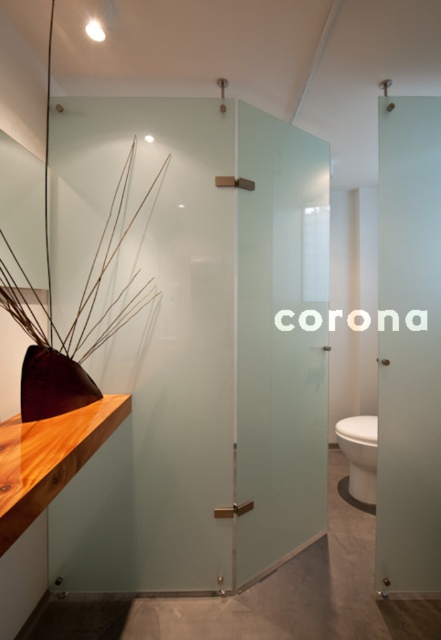
Based on the photo, between frosted glass screen door at center and satin glass screen door at right, which one has more height?

satin glass screen door at right is taller.

Who is higher up, frosted glass screen door at center or satin glass screen door at right?

satin glass screen door at right

Does point (313, 253) lie in front of point (408, 323)?

No, it is not.

Where is `frosted glass screen door at center`? This screenshot has height=640, width=441. frosted glass screen door at center is located at coordinates (280, 340).

Image resolution: width=441 pixels, height=640 pixels. What are the coordinates of `frosted glass screen door at center` in the screenshot? It's located at (280, 340).

Which is more to the right, frosted glass screen door at center or white glossy toilet bowl at lower right?

white glossy toilet bowl at lower right is more to the right.

The image size is (441, 640). Identify the location of frosted glass screen door at center. (280, 340).

Is point (395, 532) in front of point (358, 476)?

Yes.

What do you see at coordinates (408, 346) in the screenshot?
I see `satin glass screen door at right` at bounding box center [408, 346].

Image resolution: width=441 pixels, height=640 pixels. What do you see at coordinates (408, 346) in the screenshot? I see `satin glass screen door at right` at bounding box center [408, 346].

Find the location of a particular element. satin glass screen door at right is located at coordinates (408, 346).